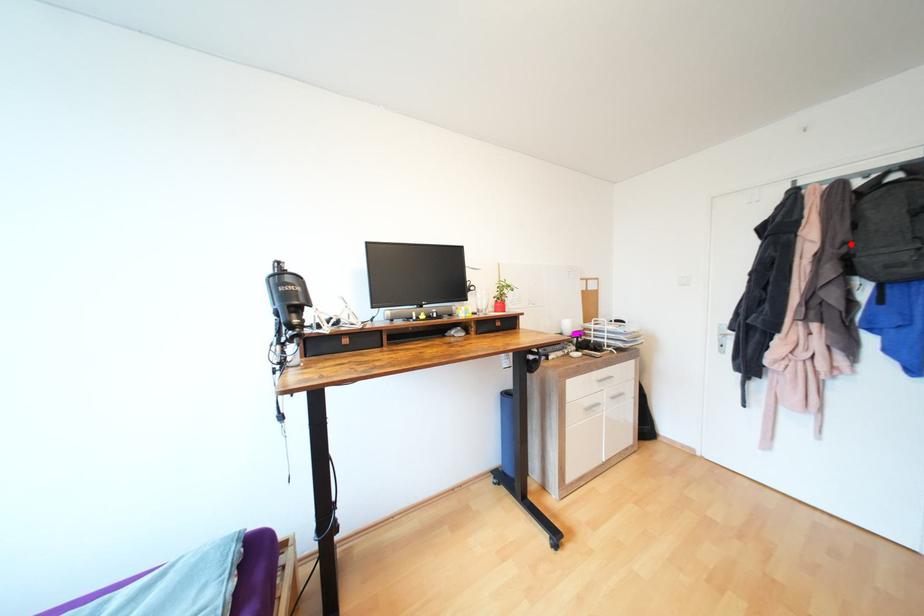
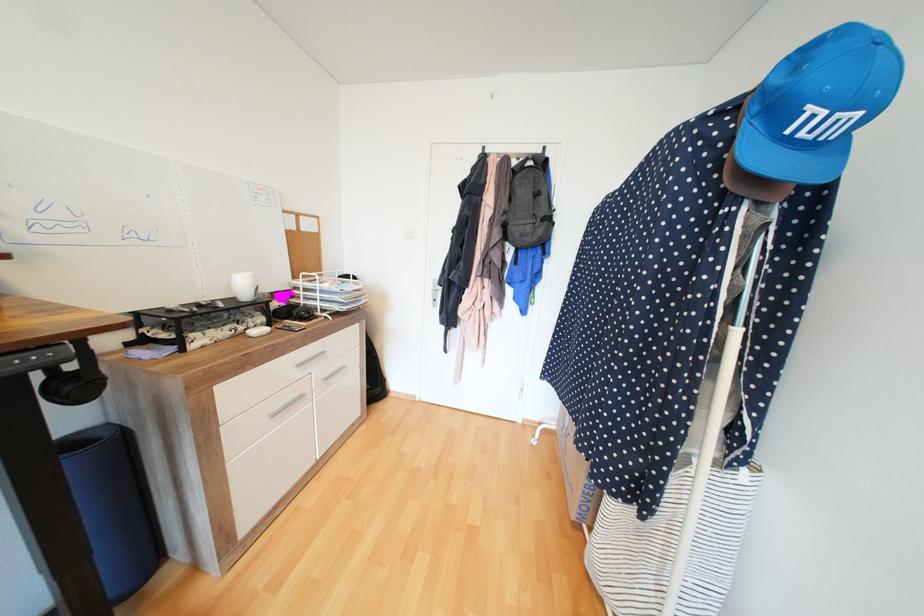
Question: I am providing you with two images of the same scene from different viewpoints. In image1, a red point is highlighted. Considering the same 3D point in image2, which of the following is correct?

Choices:
 (A) It is closer
 (B) It is farther

Answer: (A)